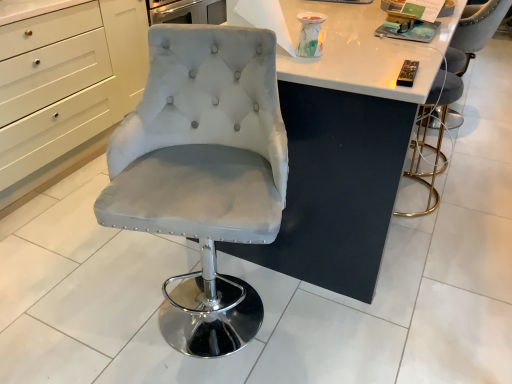
Find the location of `free area below metallic gold bar stool at right, the 2th chair from the front (from a real-world perspective)`. free area below metallic gold bar stool at right, the 2th chair from the front (from a real-world perspective) is located at coordinates click(411, 194).